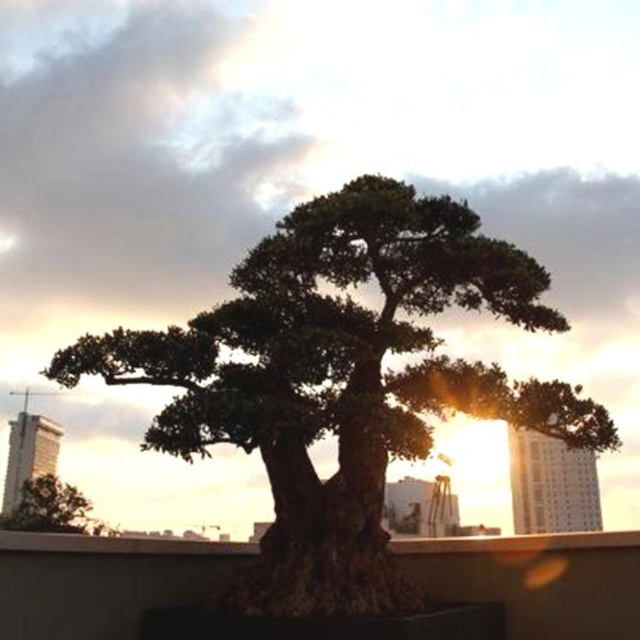
You are a gardener looking at the bonsai setup. You need to place a small decorative stone between the green textured tree at center and the green leafy tree at lower left. Based on their positions, where should you place the stone?

The green textured tree at center is located above the green leafy tree at lower left, so you should place the stone between them horizontally at the lower left side of the green textured tree at center and the upper right side of the green leafy tree at lower left.

You are standing in a garden with two trees. You see the green textured tree at center and the green leafy tree at lower left. Which tree is positioned to the right of the other?

The green textured tree at center is positioned to the right of the green leafy tree at lower left.